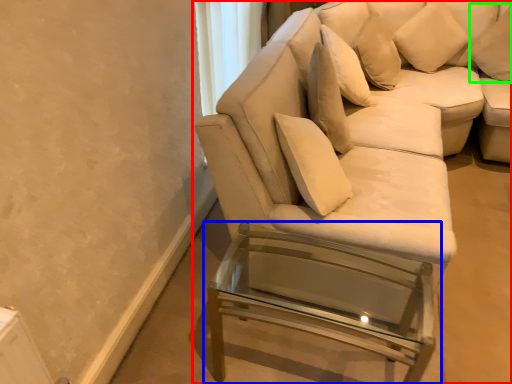
Question: Considering the real-world distances, which object is closest to studio couch (highlighted by a red box)? table (highlighted by a blue box) or pillow (highlighted by a green box).

Choices:
 (A) table
 (B) pillow

Answer: (A)